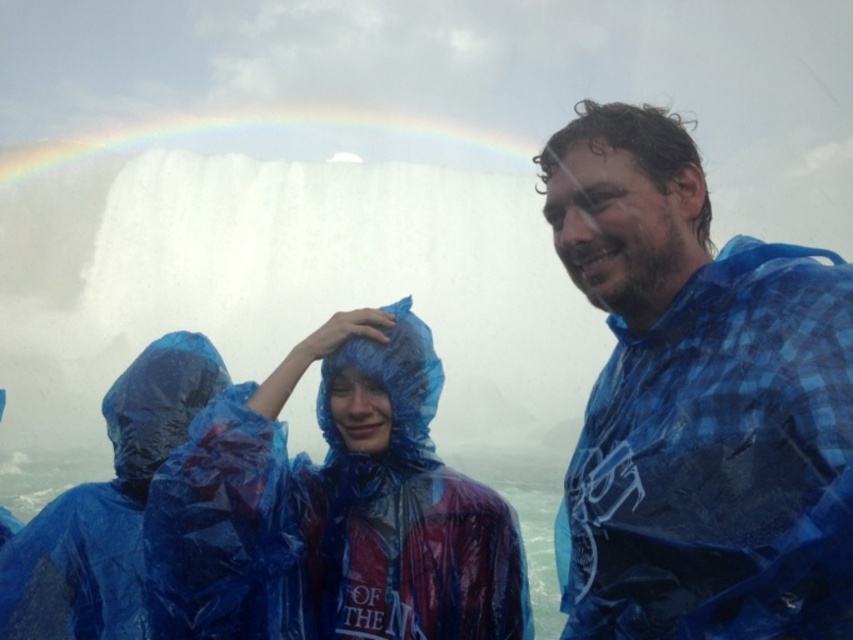
You are a photographer trying to capture the rainbow above the waterfall. You notice a person wearing a blue plaid shirt at center is blocking your shot. Can you estimate how far to the left or right you need to move to avoid them?

The blue plaid shirt at center is located at coordinates point [698,403]. To avoid the person, you should move to the left since their position is closer to the right side of the frame.

You are a photographer trying to capture the rainbow at upper center and the blue plastic poncho at lower left in the same frame. Based on their sizes in the image, which object would appear larger in your photo?

The rainbow at upper center would appear larger in the photo because the blue plastic poncho at lower left is smaller than rainbow at upper center.